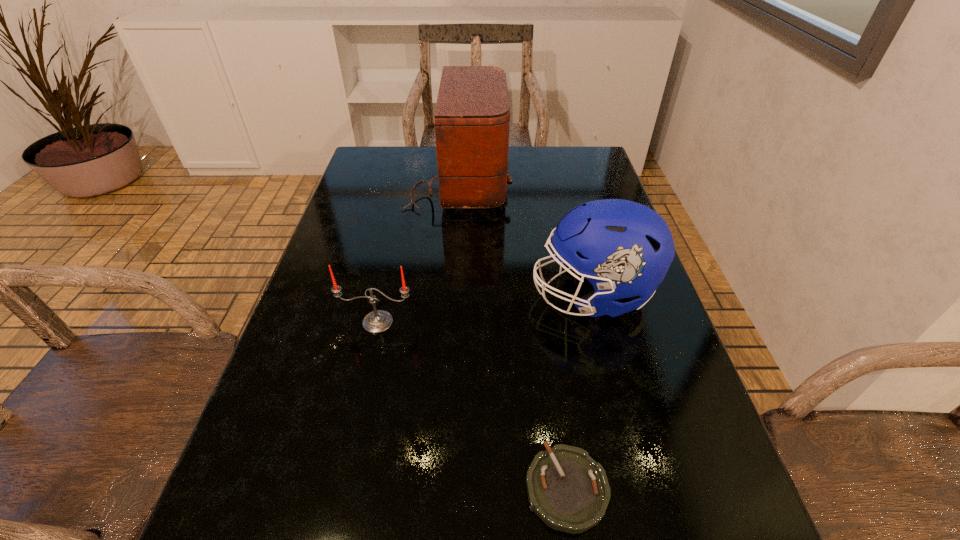
What are the coordinates of `free spot between the tallest object and the ashtray` in the screenshot? It's located at (513, 334).

At what (x,y) coordinates should I click in order to perform the action: click on free space between the tallest object and the shortest object. Please return your answer as a coordinate pair (x, y). This screenshot has height=540, width=960. Looking at the image, I should click on (513, 334).

Identify the location of the closest object relative to the radio receiver. The width and height of the screenshot is (960, 540). (624, 249).

The image size is (960, 540). I want to click on object that can be found as the closest to the candle, so click(624, 249).

Find the location of a particular element. free region that satisfies the following two spatial constraints: 1. on the face guard of the football helmet; 2. on the front-facing side of the candle is located at coordinates (599, 322).

Image resolution: width=960 pixels, height=540 pixels. Identify the location of vacant position in the image that satisfies the following two spatial constraints: 1. on the front panel of the nearest object; 2. on the right side of the radio receiver. pyautogui.click(x=437, y=488).

Identify the location of free spot that satisfies the following two spatial constraints: 1. on the front-facing side of the third tallest object; 2. on the left side of the ashtray. (341, 488).

You are a GUI agent. You are given a task and a screenshot of the screen. Output one action in this format:
    pyautogui.click(x=<x>, y=<y>)
    Task: Click on the vacant space that satisfies the following two spatial constraints: 1. on the front panel of the radio receiver; 2. on the back side of the nearest object
    The width and height of the screenshot is (960, 540).
    Given the screenshot: What is the action you would take?
    pyautogui.click(x=437, y=488)

You are a GUI agent. You are given a task and a screenshot of the screen. Output one action in this format:
    pyautogui.click(x=<x>, y=<y>)
    Task: Click on the free space that satisfies the following two spatial constraints: 1. on the front panel of the farthest object; 2. on the right side of the shortest object
    
    Given the screenshot: What is the action you would take?
    pyautogui.click(x=437, y=488)

At what (x,y) coordinates should I click in order to perform the action: click on free location that satisfies the following two spatial constraints: 1. on the front panel of the ashtray; 2. on the right side of the radio receiver. Please return your answer as a coordinate pair (x, y). The width and height of the screenshot is (960, 540). Looking at the image, I should click on (437, 488).